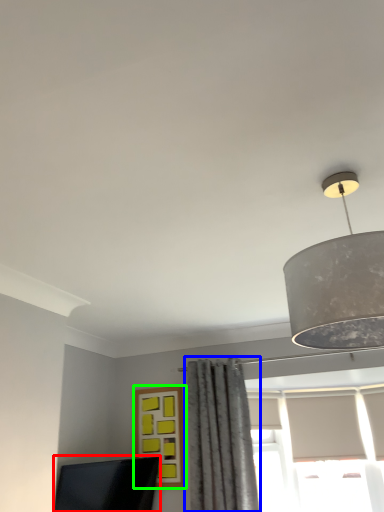
Question: Considering the real-world distances, which object is farthest from computer monitor (highlighted by a red box)? curtain (highlighted by a blue box) or window (highlighted by a green box)?

Choices:
 (A) curtain
 (B) window

Answer: (A)